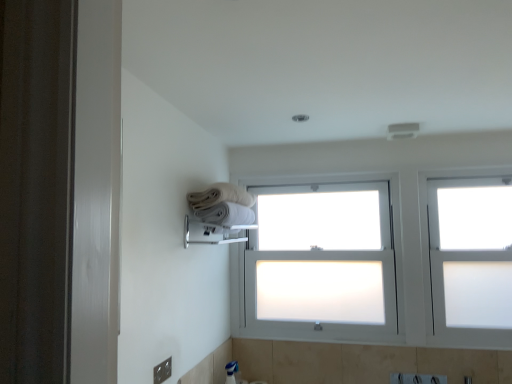
Question: Can you confirm if white frosted glass bay window at center is shorter than white soft towel at upper center, which is counted as the 2th towel, starting from the top?

Choices:
 (A) yes
 (B) no

Answer: (B)

Question: Is white frosted glass bay window at center wider than white soft towel at upper center, which is counted as the 2th towel, starting from the top?

Choices:
 (A) yes
 (B) no

Answer: (B)

Question: Is white frosted glass bay window at center looking in the opposite direction of white soft towel at upper center, which is counted as the 2th towel, starting from the top?

Choices:
 (A) no
 (B) yes

Answer: (A)

Question: Does white frosted glass bay window at center turn towards white soft towel at upper center, which is counted as the 2th towel, starting from the top?

Choices:
 (A) no
 (B) yes

Answer: (B)

Question: Is white soft towel at upper center, which is counted as the 2th towel, starting from the top, a part of white frosted glass bay window at center?

Choices:
 (A) yes
 (B) no

Answer: (B)

Question: Is white frosted glass bay window at center situated inside white cotton towels at upper center, the 2th towel positioned from the bottom, or outside?

Choices:
 (A) inside
 (B) outside

Answer: (B)

Question: Is white frosted glass bay window at center bigger or smaller than white cotton towels at upper center, which is counted as the 1th towel, starting from the top?

Choices:
 (A) small
 (B) big

Answer: (B)

Question: Considering the positions of point (362, 205) and point (220, 198), is point (362, 205) closer or farther from the camera than point (220, 198)?

Choices:
 (A) closer
 (B) farther

Answer: (B)

Question: From the image's perspective, is white frosted glass bay window at center positioned above or below white cotton towels at upper center, the 2th towel positioned from the bottom?

Choices:
 (A) above
 (B) below

Answer: (B)

Question: Based on their sizes in the image, would you say white soft towel at upper center, positioned as the first towel in bottom-to-top order, is bigger or smaller than white frosted glass window at upper right?

Choices:
 (A) small
 (B) big

Answer: (A)

Question: In terms of height, does white soft towel at upper center, positioned as the first towel in bottom-to-top order, look taller or shorter compared to white frosted glass window at upper right?

Choices:
 (A) short
 (B) tall

Answer: (A)

Question: Is white soft towel at upper center, positioned as the first towel in bottom-to-top order, inside or outside of white frosted glass window at upper right?

Choices:
 (A) inside
 (B) outside

Answer: (B)

Question: From the image's perspective, is white soft towel at upper center, positioned as the first towel in bottom-to-top order, positioned above or below white frosted glass window at upper right?

Choices:
 (A) above
 (B) below

Answer: (A)

Question: In terms of width, does white frosted glass bay window at center look wider or thinner when compared to metallic silver outlet at lower left?

Choices:
 (A) thin
 (B) wide

Answer: (B)

Question: Considering the positions of white frosted glass bay window at center and metallic silver outlet at lower left in the image, is white frosted glass bay window at center taller or shorter than metallic silver outlet at lower left?

Choices:
 (A) tall
 (B) short

Answer: (A)